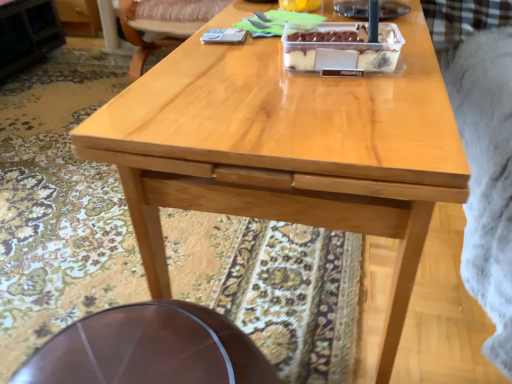
At what (x,y) coordinates should I click in order to perform the action: click on free spot in front of translucent plastic container at center. Please return your answer as a coordinate pair (x, y). Looking at the image, I should click on (358, 101).